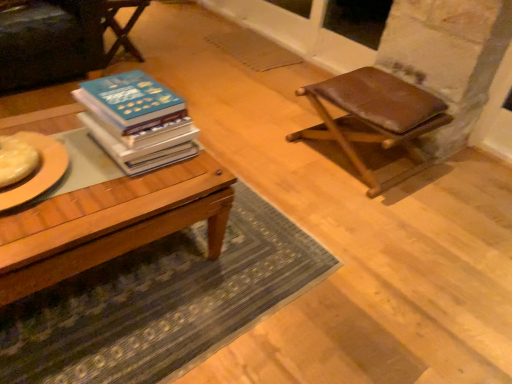
Question: Considering the relative sizes of wooden chair at upper left and wooden table at center in the image provided, is wooden chair at upper left taller than wooden table at center?

Choices:
 (A) no
 (B) yes

Answer: (B)

Question: Considering the relative positions of wooden chair at upper left and wooden table at center in the image provided, is wooden chair at upper left to the right of wooden table at center from the viewer's perspective?

Choices:
 (A) no
 (B) yes

Answer: (A)

Question: Is wooden chair at upper left far away from wooden table at center?

Choices:
 (A) yes
 (B) no

Answer: (A)

Question: From the image's perspective, does wooden chair at upper left appear lower than wooden table at center?

Choices:
 (A) yes
 (B) no

Answer: (B)

Question: Is wooden chair at upper left oriented away from wooden table at center?

Choices:
 (A) no
 (B) yes

Answer: (A)

Question: From a real-world perspective, is green textured rug at lower center above or below wooden table at center?

Choices:
 (A) above
 (B) below

Answer: (B)

Question: From the image's perspective, is green textured rug at lower center positioned above or below wooden table at center?

Choices:
 (A) above
 (B) below

Answer: (B)

Question: Does point (190, 336) appear closer or farther from the camera than point (54, 200)?

Choices:
 (A) farther
 (B) closer

Answer: (A)

Question: Is green textured rug at lower center taller or shorter than wooden table at center?

Choices:
 (A) short
 (B) tall

Answer: (A)

Question: Would you say wooden chair at upper left is inside or outside wooden table at center?

Choices:
 (A) inside
 (B) outside

Answer: (B)

Question: From their relative heights in the image, would you say wooden chair at upper left is taller or shorter than wooden table at center?

Choices:
 (A) tall
 (B) short

Answer: (A)

Question: From a real-world perspective, is wooden chair at upper left above or below wooden table at center?

Choices:
 (A) above
 (B) below

Answer: (A)

Question: Does point (104, 9) appear closer or farther from the camera than point (101, 241)?

Choices:
 (A) farther
 (B) closer

Answer: (A)

Question: Is point (337, 122) closer or farther from the camera than point (105, 3)?

Choices:
 (A) closer
 (B) farther

Answer: (B)

Question: Considering the relative positions of brown leather stool at right and wooden chair at upper left in the image provided, is brown leather stool at right to the left or to the right of wooden chair at upper left?

Choices:
 (A) left
 (B) right

Answer: (B)